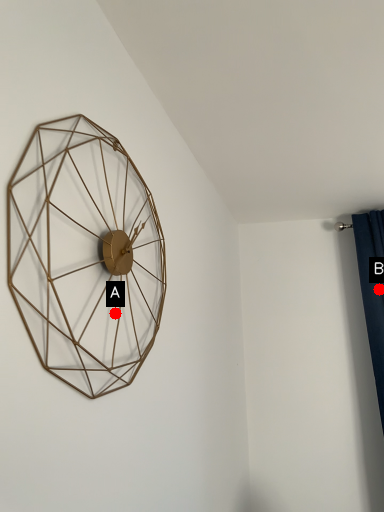
Question: Two points are circled on the image, labeled by A and B beside each circle. Which point is further to the camera?

Choices:
 (A) A is further
 (B) B is further

Answer: (B)